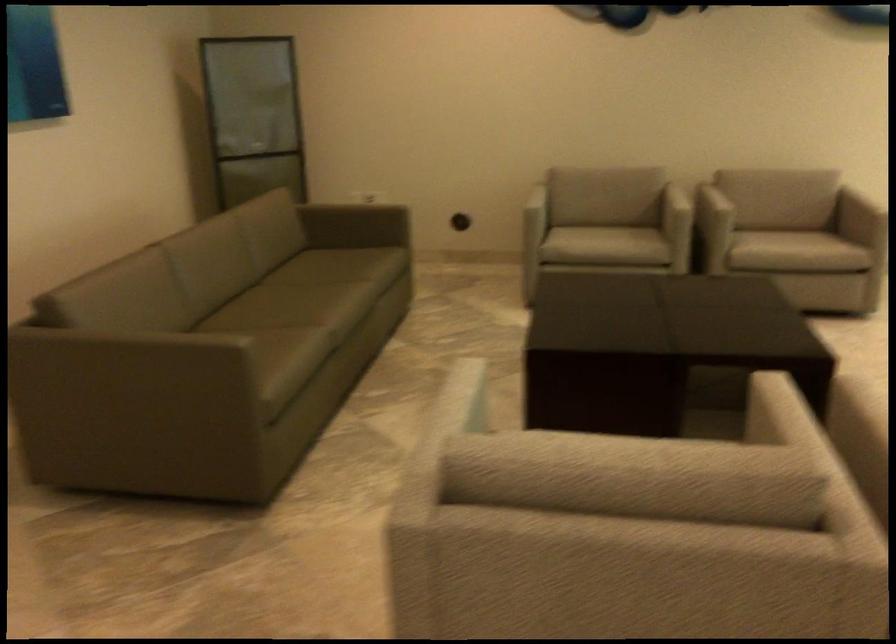
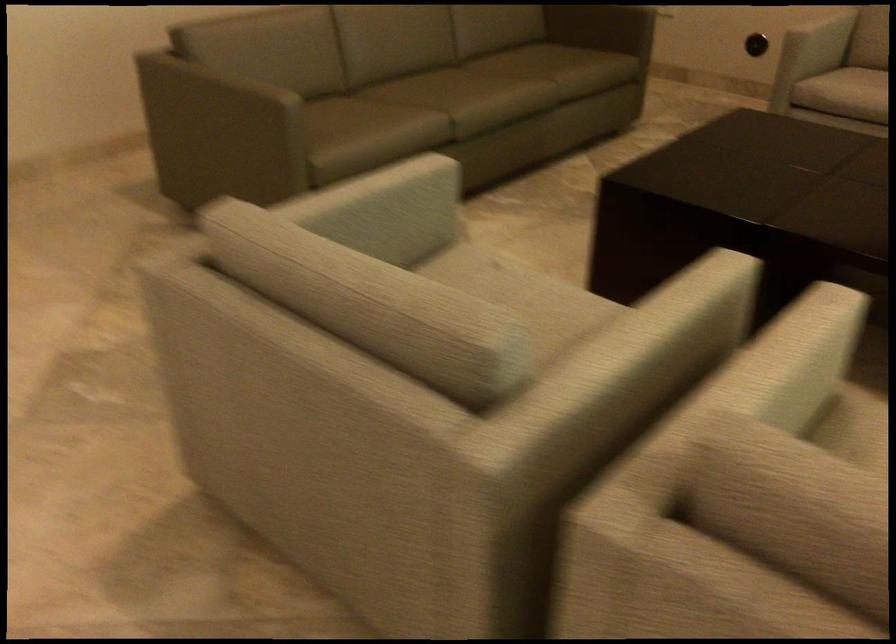
In the second image, find the point that corresponds to [538,201] in the first image.

(821, 35)